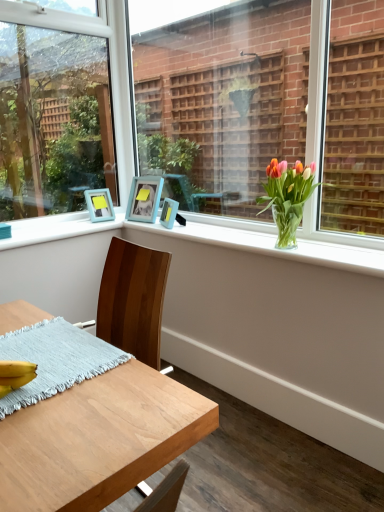
Question: Can you confirm if clear glass vase at upper center is smaller than matte blue picture frame at upper center, which ranks as the 3th picture frame in left-to-right order?

Choices:
 (A) no
 (B) yes

Answer: (A)

Question: Does clear glass vase at upper center appear on the right side of matte blue picture frame at upper center, which ranks as the 3th picture frame in left-to-right order?

Choices:
 (A) no
 (B) yes

Answer: (B)

Question: From the image's perspective, is clear glass vase at upper center over matte blue picture frame at upper center, which is the 1th picture frame in right-to-left order?

Choices:
 (A) yes
 (B) no

Answer: (B)

Question: From the image's perspective, would you say clear glass vase at upper center is shown under matte blue picture frame at upper center, which ranks as the 3th picture frame in left-to-right order?

Choices:
 (A) no
 (B) yes

Answer: (B)

Question: From a real-world perspective, does clear glass vase at upper center stand above matte blue picture frame at upper center, which is the 1th picture frame in right-to-left order?

Choices:
 (A) yes
 (B) no

Answer: (B)

Question: Considering the positions of wooden desk at lower left and clear glass vase at center, which is the 1th window from right to left, in the image, is wooden desk at lower left taller or shorter than clear glass vase at center, which is the 1th window from right to left,?

Choices:
 (A) tall
 (B) short

Answer: (B)

Question: Based on their sizes in the image, would you say wooden desk at lower left is bigger or smaller than clear glass vase at center, which is the 1th window from right to left?

Choices:
 (A) small
 (B) big

Answer: (B)

Question: From a real-world perspective, is wooden desk at lower left positioned above or below clear glass vase at center, which is the 1th window from right to left?

Choices:
 (A) below
 (B) above

Answer: (A)

Question: Considering the positions of wooden desk at lower left and clear glass vase at center, which is the 1th window from right to left, in the image, is wooden desk at lower left wider or thinner than clear glass vase at center, which is the 1th window from right to left,?

Choices:
 (A) thin
 (B) wide

Answer: (B)

Question: From the image's perspective, is teal wooden picture frame at upper left, which appears as the third picture frame when viewed from the right, positioned above or below matte blue picture frame at upper center, which ranks as the 3th picture frame in left-to-right order?

Choices:
 (A) above
 (B) below

Answer: (A)

Question: Relative to matte blue picture frame at upper center, which is the 1th picture frame in right-to-left order, is teal wooden picture frame at upper left, the first picture frame viewed from the left, in front or behind?

Choices:
 (A) behind
 (B) front

Answer: (A)

Question: In terms of height, does teal wooden picture frame at upper left, which appears as the third picture frame when viewed from the right, look taller or shorter compared to matte blue picture frame at upper center, which is the 1th picture frame in right-to-left order?

Choices:
 (A) short
 (B) tall

Answer: (B)

Question: Is teal wooden picture frame at upper left, which appears as the third picture frame when viewed from the right, to the left or to the right of matte blue picture frame at upper center, which is the 1th picture frame in right-to-left order, in the image?

Choices:
 (A) left
 (B) right

Answer: (A)

Question: From the image's perspective, is blue woven placemat at lower left located above or below translucent glass vase at upper right?

Choices:
 (A) below
 (B) above

Answer: (A)

Question: Choose the correct answer: Is blue woven placemat at lower left inside translucent glass vase at upper right or outside it?

Choices:
 (A) inside
 (B) outside

Answer: (B)